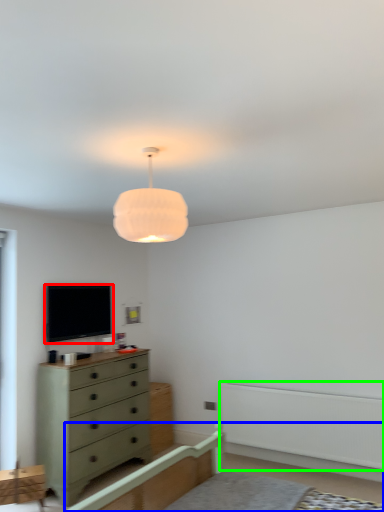
Question: Estimate the real-world distances between objects in this image. Which object is farther from television (highlighted by a red box), bed frame (highlighted by a blue box) or balustrade (highlighted by a green box)?

Choices:
 (A) bed frame
 (B) balustrade

Answer: (B)